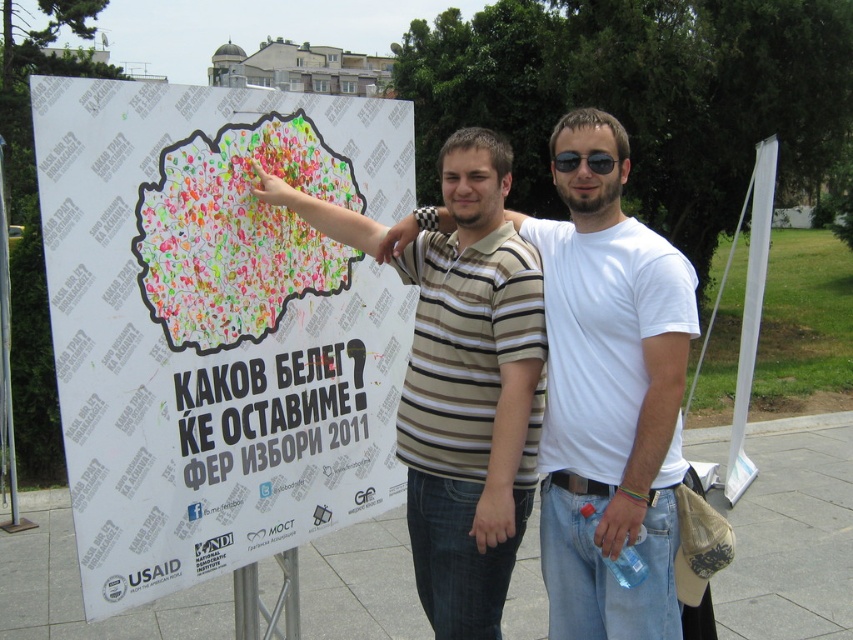
You are standing in front of the white paper poster at left located at point (216, 323). There is a person to your right. Where is the person standing relative to the poster?

The person is to the right of the white paper poster at left located at point (216, 323).

Please describe the exact 2D coordinates of the white paper poster at left in the image.

The white paper poster at left is located at the 2D coordinates of point (216, 323).

Consider the image. You are standing in front of the scene described. You want to take a photo of the white paper poster at left without including any of the two individuals. Since the camera you have can focus on objects within 5 feet, will you be able to capture the poster clearly without the people in the frame?

The white paper poster at left is 6.86 feet from camera, which is beyond the camera focus range of 5 feet. Therefore, you cannot capture the poster clearly as it is out of focus range, and adjusting the focus might still include the individuals in the frame.